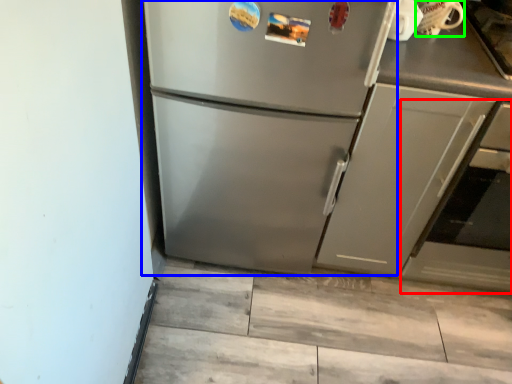
Question: Which is farther away from oven (highlighted by a red box)? refrigerator (highlighted by a blue box) or appliance (highlighted by a green box)?

Choices:
 (A) refrigerator
 (B) appliance

Answer: (A)